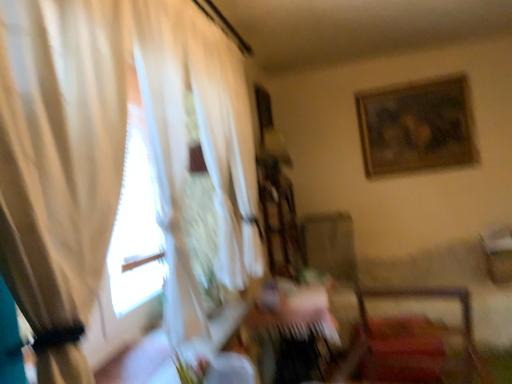
Question: Can you confirm if wooden framed artwork at upper right is shorter than wooden table at center?

Choices:
 (A) no
 (B) yes

Answer: (A)

Question: Is wooden framed artwork at upper right at the left side of wooden table at center?

Choices:
 (A) yes
 (B) no

Answer: (B)

Question: Does wooden framed artwork at upper right appear on the right side of wooden table at center?

Choices:
 (A) yes
 (B) no

Answer: (A)

Question: Considering the relative sizes of wooden framed artwork at upper right and wooden table at center in the image provided, is wooden framed artwork at upper right smaller than wooden table at center?

Choices:
 (A) yes
 (B) no

Answer: (A)

Question: Is wooden framed artwork at upper right wider than wooden table at center?

Choices:
 (A) no
 (B) yes

Answer: (A)

Question: From the image's perspective, is wooden framed artwork at upper right above or below wooden table at center?

Choices:
 (A) above
 (B) below

Answer: (A)

Question: Does point (438, 144) appear closer or farther from the camera than point (309, 309)?

Choices:
 (A) farther
 (B) closer

Answer: (A)

Question: Considering their positions, is wooden framed artwork at upper right located in front of or behind wooden table at center?

Choices:
 (A) behind
 (B) front

Answer: (A)

Question: From a real-world perspective, is wooden framed artwork at upper right positioned above or below wooden table at center?

Choices:
 (A) below
 (B) above

Answer: (B)

Question: Looking at their shapes, would you say velvet red chair at lower right is wider or thinner than wooden table at center?

Choices:
 (A) thin
 (B) wide

Answer: (B)

Question: In the image, is velvet red chair at lower right positioned in front of or behind wooden table at center?

Choices:
 (A) front
 (B) behind

Answer: (A)

Question: Is velvet red chair at lower right to the left or to the right of wooden table at center in the image?

Choices:
 (A) right
 (B) left

Answer: (A)

Question: In terms of height, does velvet red chair at lower right look taller or shorter compared to wooden table at center?

Choices:
 (A) tall
 (B) short

Answer: (B)

Question: Is point (303, 314) closer or farther from the camera than point (391, 102)?

Choices:
 (A) farther
 (B) closer

Answer: (B)

Question: In terms of width, does wooden table at center look wider or thinner when compared to wooden framed artwork at upper right?

Choices:
 (A) thin
 (B) wide

Answer: (B)